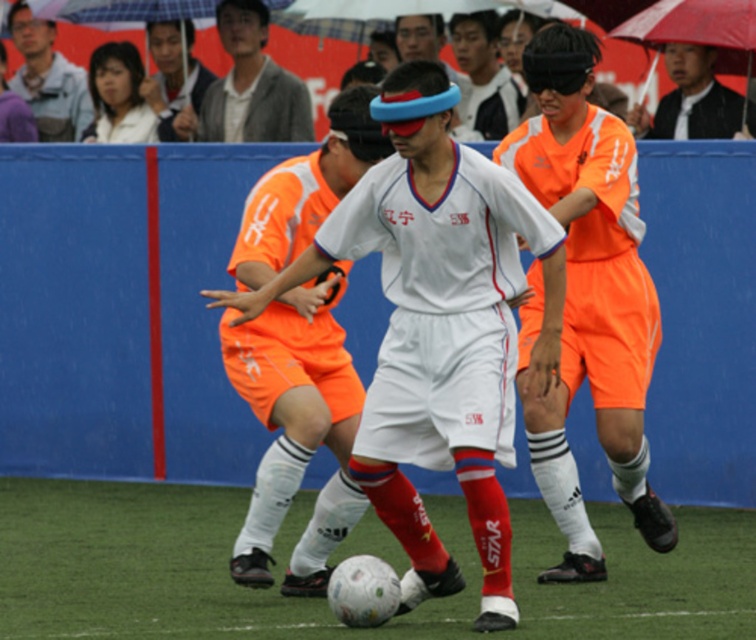
Question: Is white matte soccer ball at center to the left of matte orange uniform at center from the viewer's perspective?

Choices:
 (A) no
 (B) yes

Answer: (B)

Question: Which of the following is the farthest from the observer?

Choices:
 (A) white matte soccer ball at center
 (B) matte orange uniform at center
 (C) green grass at center

Answer: (B)

Question: In this image, where is white matte soccer ball at center located relative to matte gray shirt at upper left?

Choices:
 (A) above
 (B) below

Answer: (B)

Question: Can you confirm if matte gray jacket at upper center is positioned below matte orange uniform at center?

Choices:
 (A) no
 (B) yes

Answer: (A)

Question: Which point is farther from the camera taking this photo?

Choices:
 (A) (160, 81)
 (B) (553, 344)
 (C) (194, 118)

Answer: (A)

Question: Estimate the real-world distances between objects in this image. Which object is farther from the white matte soccer ball at center?

Choices:
 (A) matte orange uniform at center
 (B) matte gray shirt at upper left

Answer: (B)